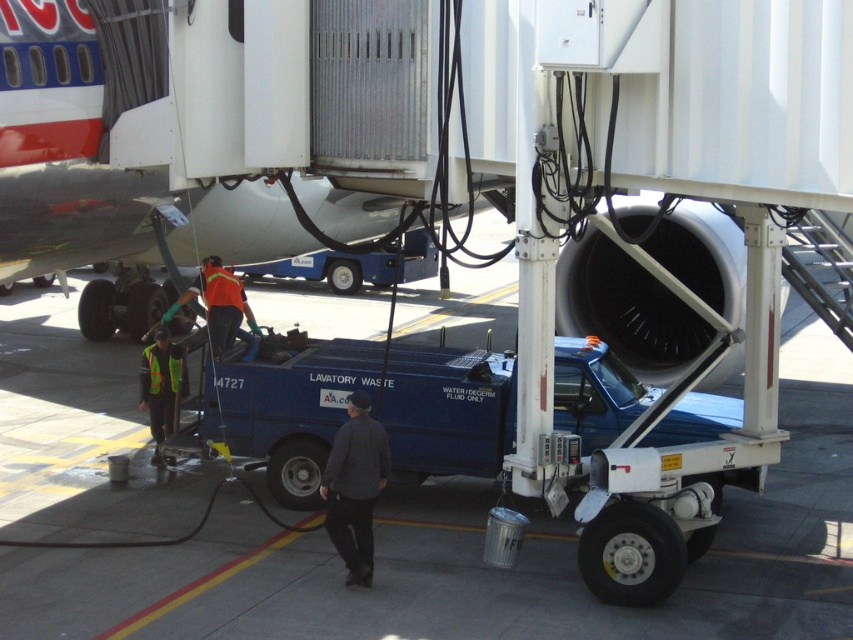
You are a ground crew member who needs to move the dark gray sweater at center out of the way. Since the blue metallic truck at lower center is in the way, can you move the truck first to make space?

The blue metallic truck at lower center is larger in size than the dark gray sweater at center, so moving the truck might be more challenging but possible if there is enough space. However, since the truck is connected to the aircraft via a hose, you should first disconnect the hose before attempting to move it to safely create space for the sweater.

You are a ground crew member approaching the reflective yellow vest at center to deliver a tool. Which side of the blue metallic truck at lower center should you walk around to reach the vest?

The blue metallic truck at lower center is positioned on the right side of reflective yellow vest at center. Therefore, to reach the reflective yellow vest at center, you should walk around the left side of the blue metallic truck at lower center.